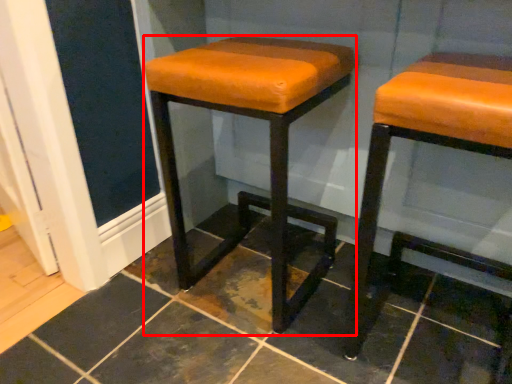
Question: From the image, what is the correct spatial relationship of stool (annotated by the red box) in relation to stool?

Choices:
 (A) right
 (B) left

Answer: (B)